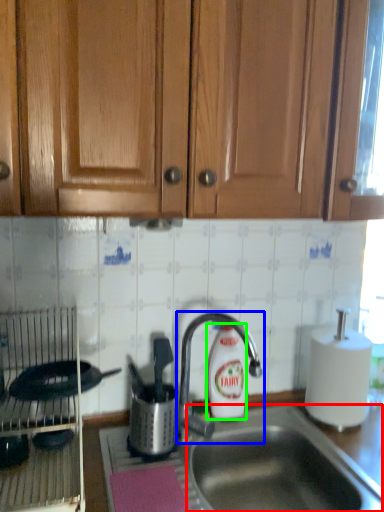
Question: Estimate the real-world distances between objects in this image. Which object is closer to sink (highlighted by a red box), tap (highlighted by a blue box) or cleaning product (highlighted by a green box)?

Choices:
 (A) tap
 (B) cleaning product

Answer: (B)